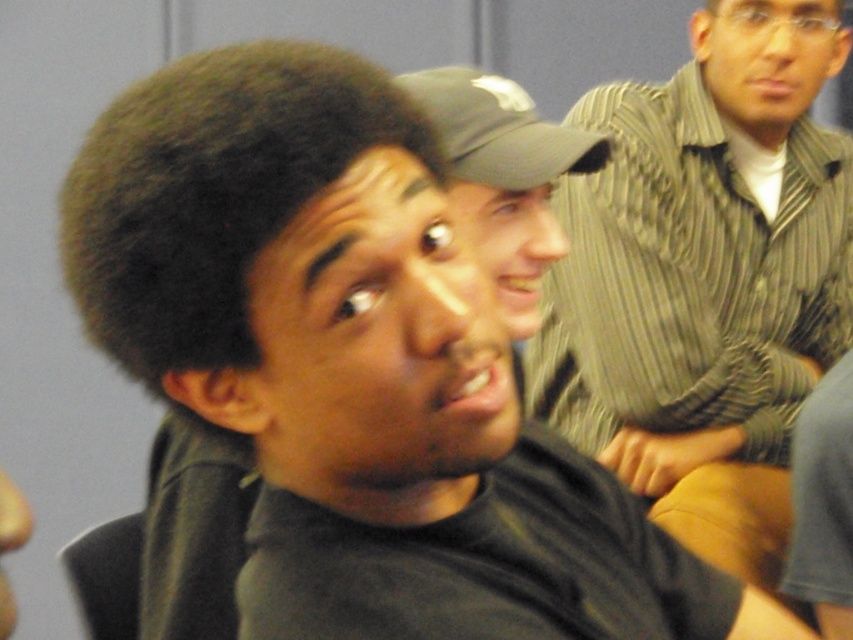
You are standing at the origin point in the image and want to move towards the point at coordinates point (705, 236). Which direction should you go relative to the point (436, 99)?

Since point (705, 236) is behind point (436, 99), you should move in the direction away from point (436, 99) to reach point (705, 236).